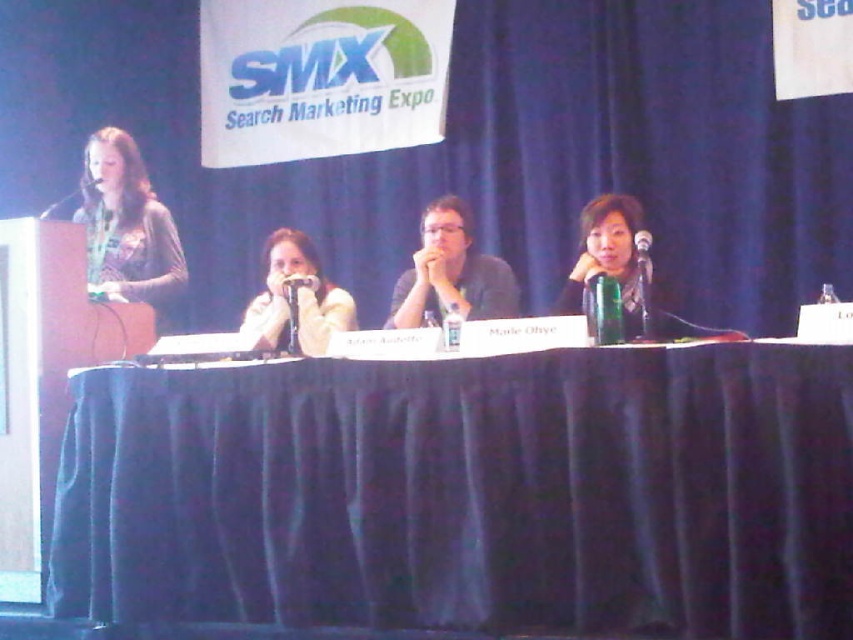
Who is taller, white fuzzy sweater at center or black plastic microphone at upper center?

white fuzzy sweater at center

At what (x,y) coordinates should I click in order to perform the action: click on white fuzzy sweater at center. Please return your answer as a coordinate pair (x, y). The width and height of the screenshot is (853, 640). Looking at the image, I should click on (296, 298).

The width and height of the screenshot is (853, 640). Find the location of `white fuzzy sweater at center`. white fuzzy sweater at center is located at coordinates (296, 298).

Measure the distance between black fabric table at center and white fuzzy sweater at center.

black fabric table at center is 32.24 inches from white fuzzy sweater at center.

Between point (367, 532) and point (306, 355), which one is positioned behind?

The point (306, 355) is more distant.

Where is `black fabric table at center`? black fabric table at center is located at coordinates (468, 493).

Is white fuzzy sweater at center thinner than matte black hair at right?

Incorrect, white fuzzy sweater at center's width is not less than matte black hair at right's.

Is white fuzzy sweater at center positioned in front of matte black hair at right?

No, it is behind matte black hair at right.

Which is in front, point (241, 324) or point (610, 259)?

Point (610, 259) is more forward.

In order to click on white fuzzy sweater at center in this screenshot , I will do `click(296, 298)`.